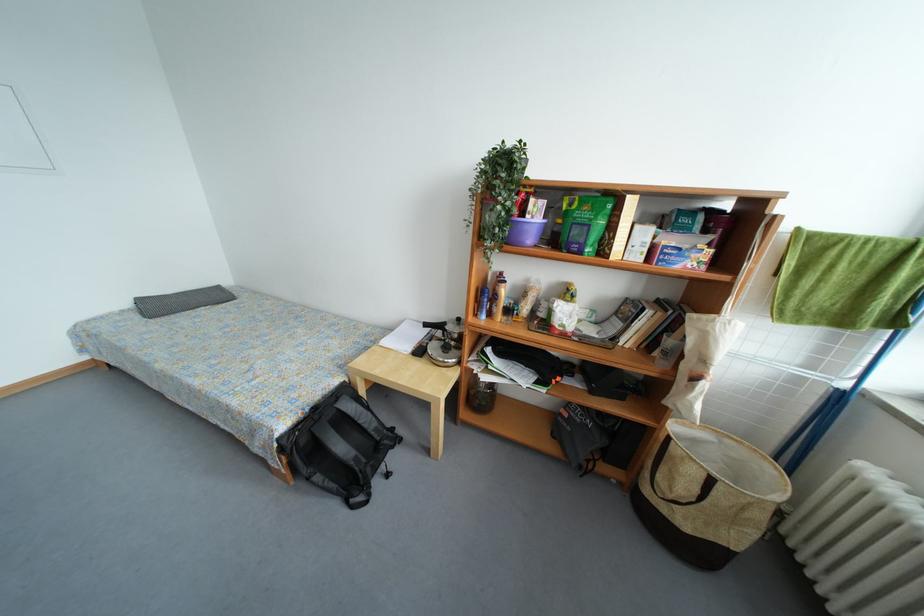
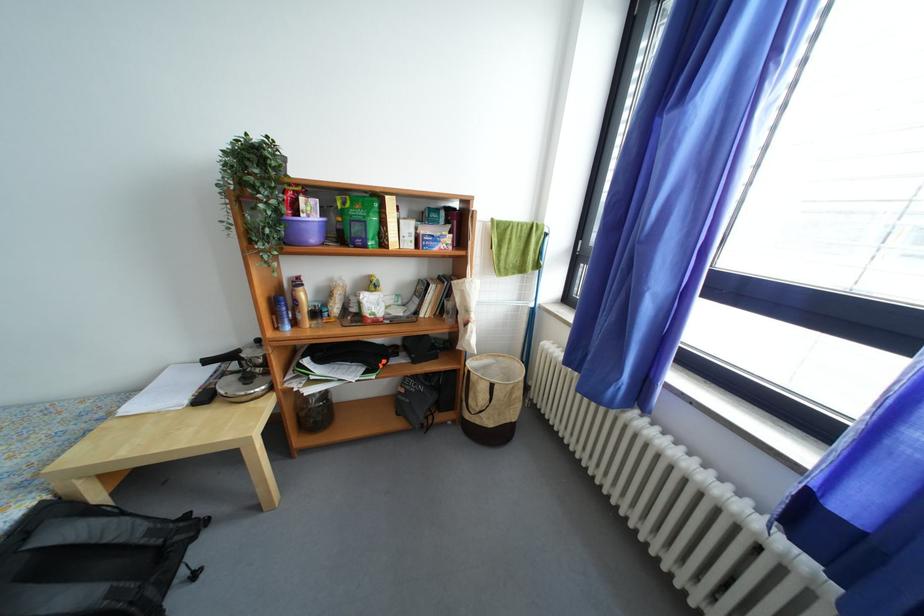
Find the pixel in the second image that matches the point at 445,339 in the first image.

(240, 371)